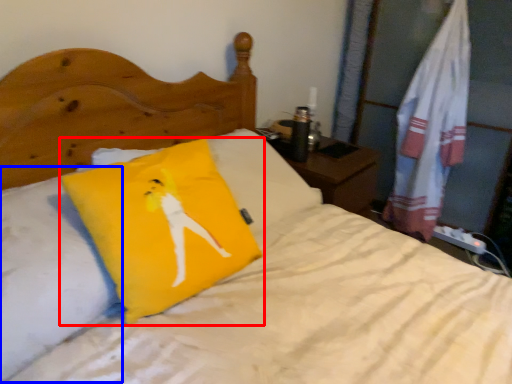
Question: Which object appears farthest to the camera in this image, pillow (highlighted by a red box) or pillow (highlighted by a blue box)?

Choices:
 (A) pillow
 (B) pillow

Answer: (A)